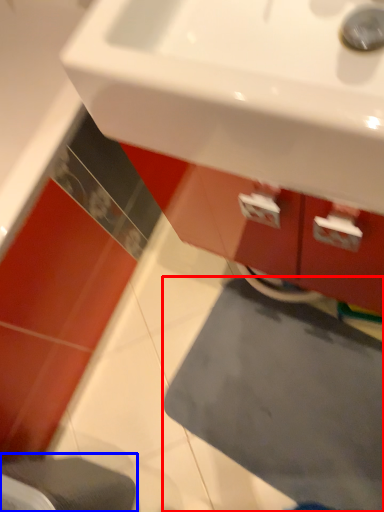
Question: Which object is further to the camera taking this photo, bath mat (highlighted by a red box) or step stool (highlighted by a blue box)?

Choices:
 (A) bath mat
 (B) step stool

Answer: (A)